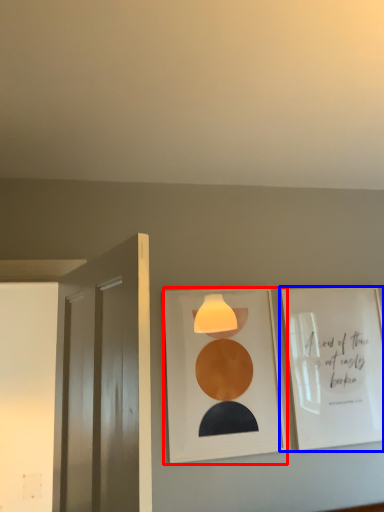
Question: Among these objects, which one is nearest to the camera, picture frame (highlighted by a red box) or picture frame (highlighted by a blue box)?

Choices:
 (A) picture frame
 (B) picture frame

Answer: (A)